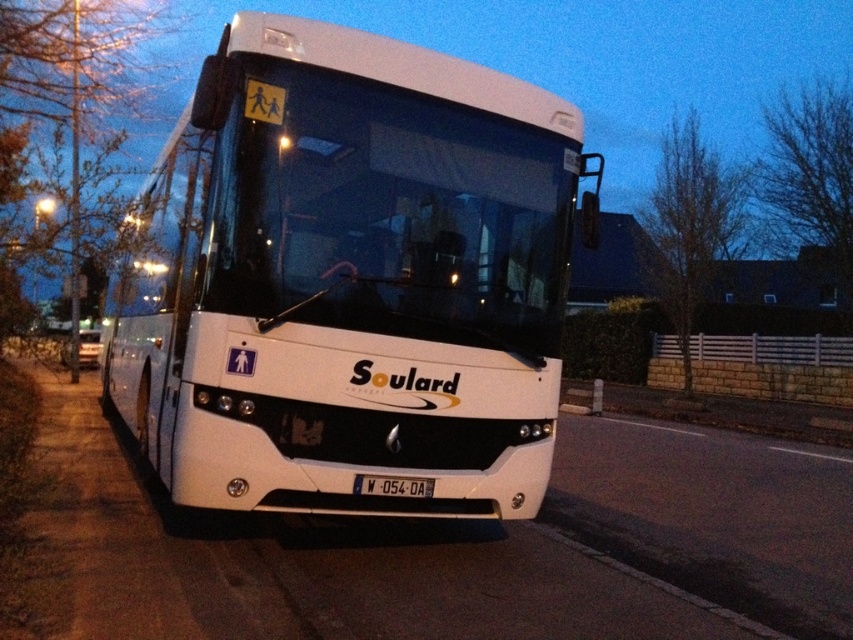
You are a delivery person trying to attach a package to the top of the white matte bus at center. Considering the height of the black plastic license plate at center, do you think you can safely place the package on the bus without it touching the license plate?

The white matte bus at center is taller than the black plastic license plate at center, so placing the package on the bus should not interfere with the license plate as the bus itself is higher.

In the scene shown: You are a pedestrian standing on the sidewalk next to the white matte bus at center and the black plastic license plate at center. Which object is closer to the road?

The white matte bus at center is positioned on the left side of the black plastic license plate at center, so the license plate is closer to the road than the bus.

From the picture: You are a delivery person who needs to place a box on the sidewalk next to the white matte bus at center. The box requires 15 feet of space. Is there enough space available?

The white matte bus at center is 15.37 feet apart from the sidewalk, so yes, there is enough space available to place the box since 15.37 feet is more than the required 15 feet.